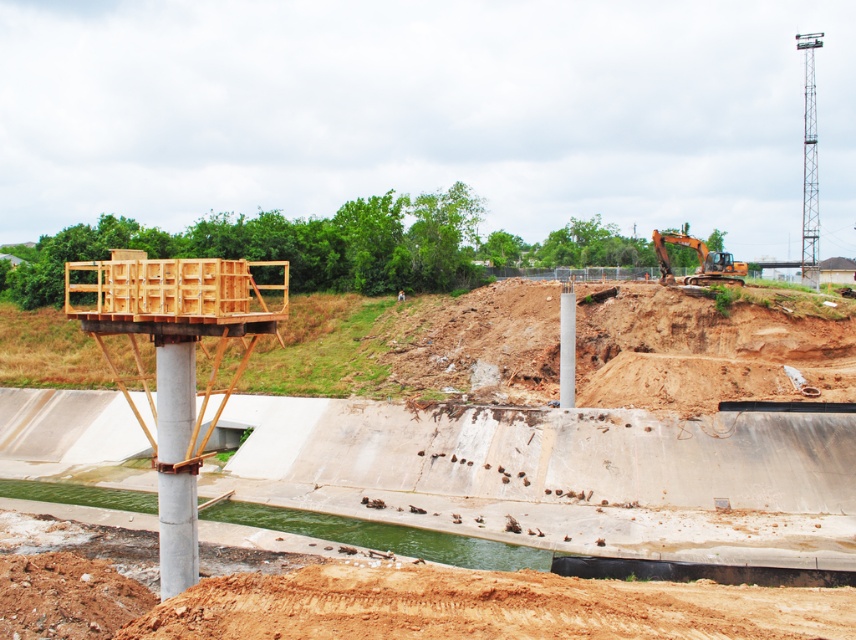
Does wooden platform at center-left appear over orange metallic excavator at upper right?

No.

This screenshot has height=640, width=856. I want to click on wooden platform at center-left, so click(x=521, y=518).

This screenshot has width=856, height=640. I want to click on wooden platform at center-left, so click(x=521, y=518).